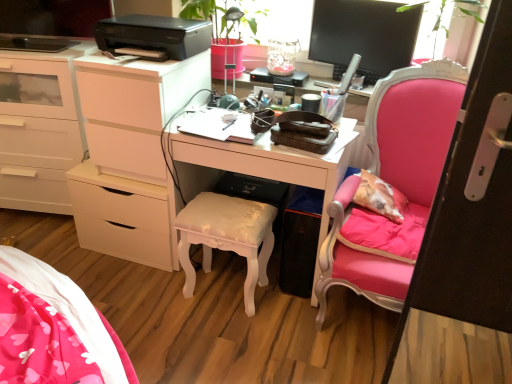
Question: Does point (415, 135) appear closer or farther from the camera than point (135, 147)?

Choices:
 (A) closer
 (B) farther

Answer: (A)

Question: Based on their sizes in the image, would you say pink velvet chair at right is bigger or smaller than white glossy chest of drawers at left?

Choices:
 (A) big
 (B) small

Answer: (A)

Question: Estimate the real-world distances between objects in this image. Which object is closer to the white glossy desk at center?

Choices:
 (A) white glossy chest of drawers at left
 (B) pink velvet chair at right
 (C) black plastic printer at upper center
 (D) white glossy stool at center
 (E) black glossy monitor at upper right

Answer: (B)

Question: Which of these objects is positioned closest to the black glossy monitor at upper right?

Choices:
 (A) white glossy chest of drawers at left
 (B) white matte cabinet at left
 (C) pink velvet chair at right
 (D) white glossy stool at center
 (E) white matte drawer at left

Answer: (C)